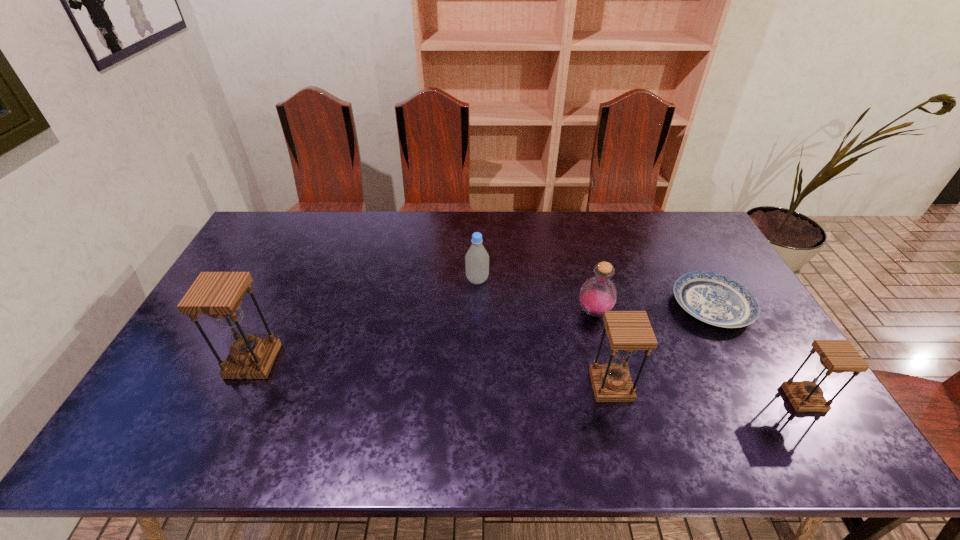
Locate an element on the screen. The image size is (960, 540). free space that satisfies the following two spatial constraints: 1. on the front side of the leftmost object; 2. on the right side of the second tallest object is located at coordinates [242, 386].